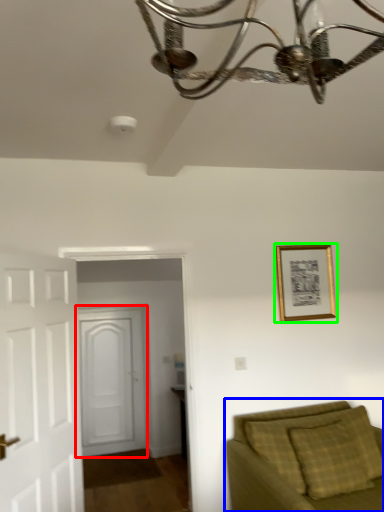
Question: Estimate the real-world distances between objects in this image. Which object is farther from door (highlighted by a red box), studio couch (highlighted by a blue box) or picture frame (highlighted by a green box)?

Choices:
 (A) studio couch
 (B) picture frame

Answer: (A)